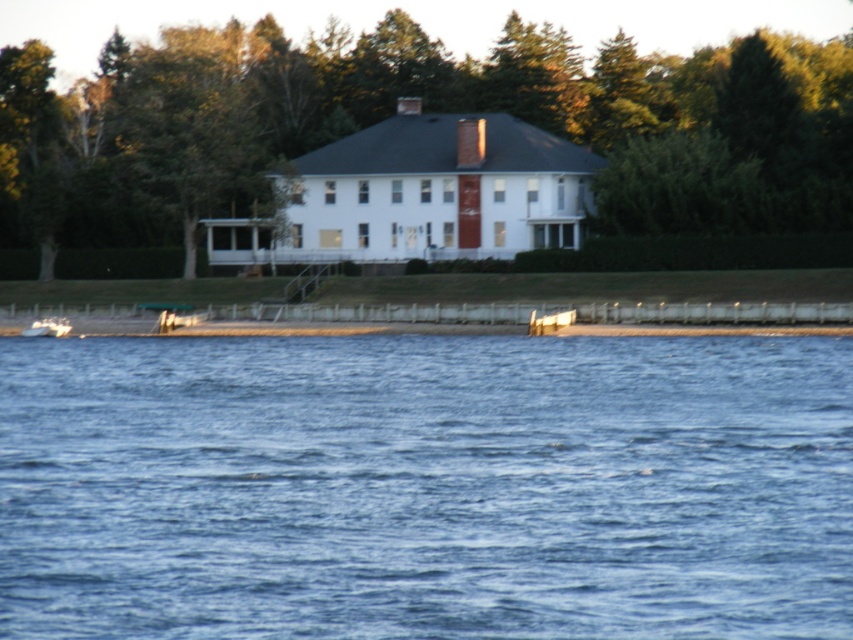
You are planning to place a new dock in the lake. The dock needs to be as wide as the blue liquid water at center. Can the white matte boat at lower left fit alongside the dock without overlapping?

The blue liquid water at center is wider than the white matte boat at lower left, so the boat can fit alongside the dock without overlapping since the dock will be as wide as the water which is wider than the boat.

You are standing at the lakeside and want to know which of the two points, point (165, 198) or point (51, 333), is closer to you. Based on the scene, can you determine this?

Point (51, 333) is closer to you because it is less further to the camera than point (165, 198).

You are standing at the camera position and want to walk to the green leafy tree at center. If your walking speed is 3 feet per second, how many seconds will it take you to reach the tree?

The distance between you and the green leafy tree at center is 293.41 feet. At a walking speed of 3 feet per second, it will take approximately 97.8 seconds to reach the tree.